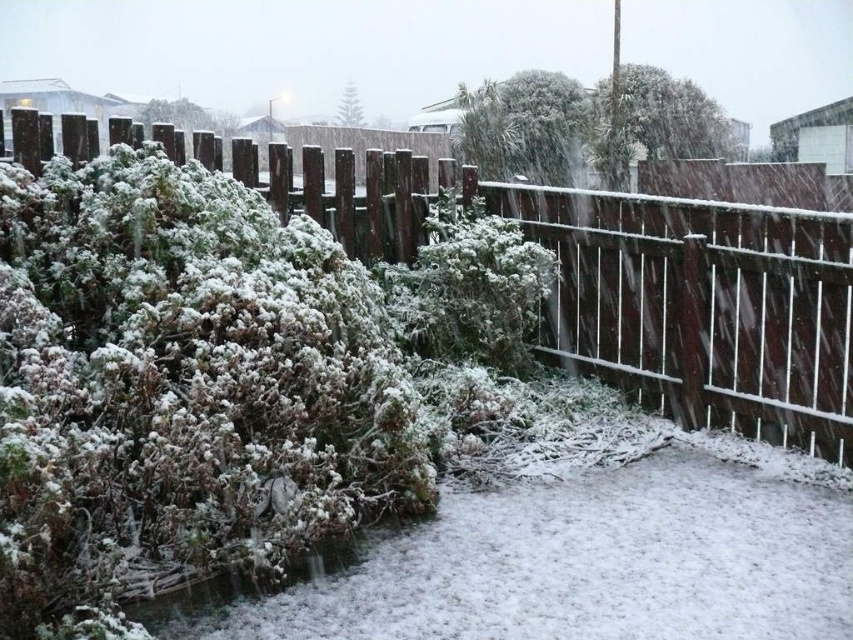
Is point (602, 244) closer to camera compared to point (488, 289)?

Yes, point (602, 244) is in front of point (488, 289).

Can you confirm if brown wooden fence at center is bigger than frosted green bush at center?

Correct, brown wooden fence at center is larger in size than frosted green bush at center.

Does point (584, 316) come farther from viewer compared to point (486, 337)?

Yes, point (584, 316) is behind point (486, 337).

Find the location of a particular element. This screenshot has height=640, width=853. brown wooden fence at center is located at coordinates (698, 305).

Is brown wooden fence at center further to camera compared to frosted green bush at upper center?

No, brown wooden fence at center is in front of frosted green bush at upper center.

Is point (387, 232) positioned in front of point (502, 156)?

Yes, it is in front of point (502, 156).

Does point (453, 172) lie in front of point (556, 125)?

That is True.

The height and width of the screenshot is (640, 853). In order to click on brown wooden fence at center in this screenshot , I will do point(698,305).

Is frosted green bush at center above frosted green bush at upper center?

Incorrect, frosted green bush at center is not positioned above frosted green bush at upper center.

Which is more to the left, frosted green bush at center or frosted green bush at upper center?

frosted green bush at center is more to the left.

What do you see at coordinates (469, 289) in the screenshot?
I see `frosted green bush at center` at bounding box center [469, 289].

Image resolution: width=853 pixels, height=640 pixels. Find the location of `frosted green bush at center`. frosted green bush at center is located at coordinates (469, 289).